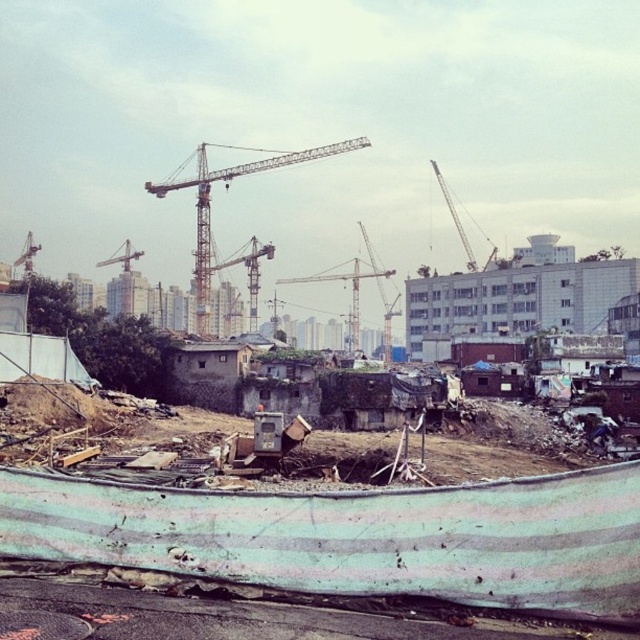
Question: Observing the image, what is the correct spatial positioning of yellow metallic crane at center in reference to metallic gray crane at upper right?

Choices:
 (A) right
 (B) left

Answer: (B)

Question: Is yellow metallic crane at center bigger than metallic yellow crane at upper center?

Choices:
 (A) no
 (B) yes

Answer: (B)

Question: Which of the following is the farthest from the observer?

Choices:
 (A) (198, 280)
 (B) (120, 308)
 (C) (464, 244)
 (D) (208, 236)

Answer: (C)

Question: Based on their relative distances, which object is nearer to the metallic yellow crane at upper center?

Choices:
 (A) metallic gray crane at center
 (B) metallic yellow crane at center
 (C) yellow metallic crane at center

Answer: (B)

Question: Is yellow metallic crane at center further to the viewer compared to metallic yellow crane at upper center?

Choices:
 (A) no
 (B) yes

Answer: (A)

Question: Estimate the real-world distances between objects in this image. Which object is farther from the yellow metallic crane at center?

Choices:
 (A) metallic gray crane at upper right
 (B) metallic gray crane at center
 (C) metallic yellow crane at center
 (D) metallic yellow crane at upper center

Answer: (D)